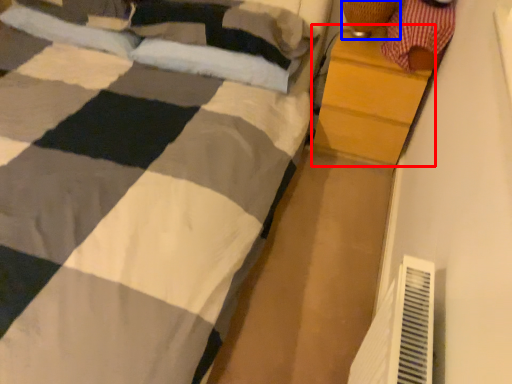
Question: Which of the following is the farthest to the observer, chest of drawers (highlighted by a red box) or lamp (highlighted by a blue box)?

Choices:
 (A) chest of drawers
 (B) lamp

Answer: (A)